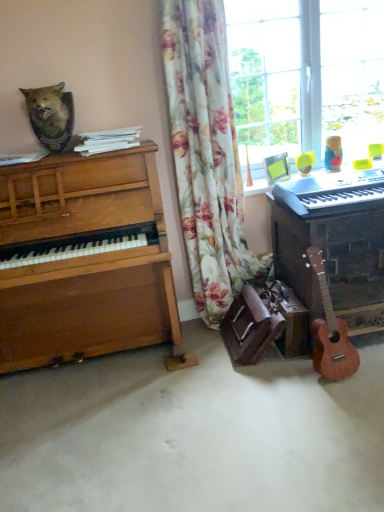
Question: Is floral fabric curtain at center further to camera compared to white plastic keyboard at right?

Choices:
 (A) yes
 (B) no

Answer: (A)

Question: Is there a large distance between floral fabric curtain at center and white plastic keyboard at right?

Choices:
 (A) yes
 (B) no

Answer: (B)

Question: Is floral fabric curtain at center next to white plastic keyboard at right?

Choices:
 (A) yes
 (B) no

Answer: (B)

Question: Is floral fabric curtain at center wider than white plastic keyboard at right?

Choices:
 (A) yes
 (B) no

Answer: (B)

Question: Does floral fabric curtain at center have a smaller size compared to white plastic keyboard at right?

Choices:
 (A) yes
 (B) no

Answer: (B)

Question: Considering their positions, is white plastic keyboard at right located in front of or behind light brown wood guitar at lower right?

Choices:
 (A) behind
 (B) front

Answer: (B)

Question: Looking at their shapes, would you say white plastic keyboard at right is wider or thinner than light brown wood guitar at lower right?

Choices:
 (A) wide
 (B) thin

Answer: (A)

Question: Considering the positions of white plastic keyboard at right and light brown wood guitar at lower right in the image, is white plastic keyboard at right bigger or smaller than light brown wood guitar at lower right?

Choices:
 (A) big
 (B) small

Answer: (B)

Question: In terms of height, does white plastic keyboard at right look taller or shorter compared to light brown wood guitar at lower right?

Choices:
 (A) tall
 (B) short

Answer: (B)

Question: In the image, is wooden piano at right, the 1th piano viewed from the right, positioned in front of or behind rustic wooden plaque at upper left?

Choices:
 (A) behind
 (B) front

Answer: (A)

Question: Is wooden piano at right, the 1th piano viewed from the right, to the left or to the right of rustic wooden plaque at upper left in the image?

Choices:
 (A) right
 (B) left

Answer: (A)

Question: Considering the positions of wooden piano at right, the 1th piano viewed from the right, and rustic wooden plaque at upper left in the image, is wooden piano at right, the 1th piano viewed from the right, bigger or smaller than rustic wooden plaque at upper left?

Choices:
 (A) big
 (B) small

Answer: (A)

Question: From the image's perspective, is wooden piano at right, the 1th piano viewed from the right, located above or below rustic wooden plaque at upper left?

Choices:
 (A) above
 (B) below

Answer: (B)

Question: Choose the correct answer: Is wooden piano at left, the first piano positioned from the left, inside wooden piano at right, the second piano from the left, or outside it?

Choices:
 (A) inside
 (B) outside

Answer: (B)

Question: From the image's perspective, is wooden piano at left, the 2th piano positioned from the right, positioned above or below wooden piano at right, the 1th piano viewed from the right?

Choices:
 (A) below
 (B) above

Answer: (A)